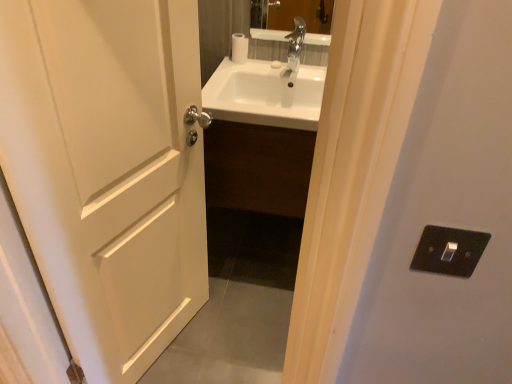
Question: Considering the relative sizes of white matte door at left and white glossy sink at center in the image provided, is white matte door at left bigger than white glossy sink at center?

Choices:
 (A) no
 (B) yes

Answer: (B)

Question: Is white matte door at left positioned with its back to white glossy sink at center?

Choices:
 (A) no
 (B) yes

Answer: (A)

Question: Can white glossy sink at center be found inside white matte door at left?

Choices:
 (A) no
 (B) yes

Answer: (A)

Question: Is the surface of white matte door at left in direct contact with white glossy sink at center?

Choices:
 (A) no
 (B) yes

Answer: (A)

Question: Is white matte door at left taller than white glossy sink at center?

Choices:
 (A) yes
 (B) no

Answer: (A)

Question: Considering the relative positions of white matte door at left and white glossy sink at center in the image provided, is white matte door at left to the left of white glossy sink at center from the viewer's perspective?

Choices:
 (A) yes
 (B) no

Answer: (A)

Question: Is white matte toilet paper at upper center not near white matte door at left?

Choices:
 (A) yes
 (B) no

Answer: (B)

Question: Is white matte toilet paper at upper center positioned in front of white matte door at left?

Choices:
 (A) no
 (B) yes

Answer: (A)

Question: Is white matte toilet paper at upper center further to the viewer compared to white matte door at left?

Choices:
 (A) no
 (B) yes

Answer: (B)

Question: Does white matte toilet paper at upper center have a greater height compared to white matte door at left?

Choices:
 (A) yes
 (B) no

Answer: (B)

Question: Is white matte door at left surrounded by white matte toilet paper at upper center?

Choices:
 (A) yes
 (B) no

Answer: (B)

Question: Does white matte toilet paper at upper center appear on the left side of white matte door at left?

Choices:
 (A) no
 (B) yes

Answer: (A)

Question: From the image's perspective, is white matte door at left below black plastic switch at right?

Choices:
 (A) no
 (B) yes

Answer: (B)